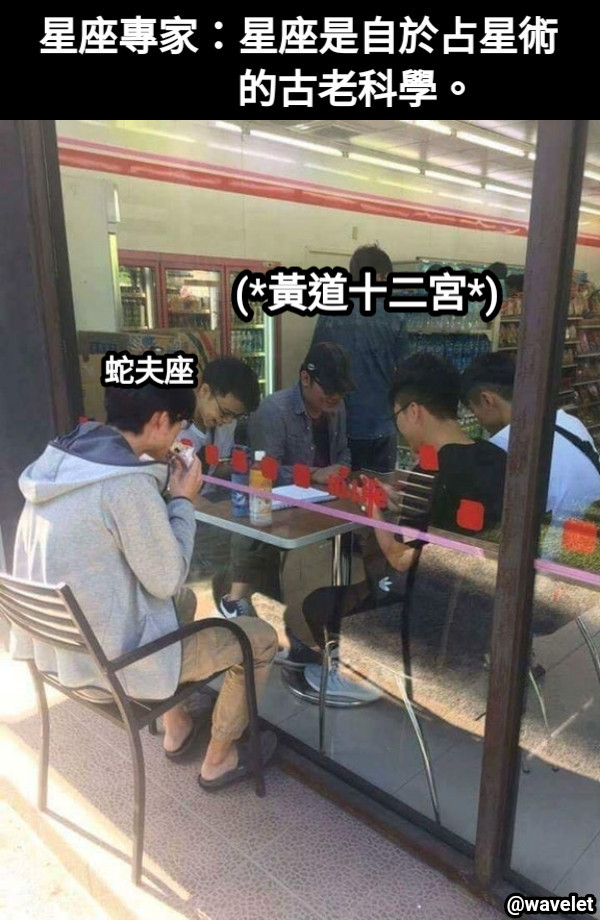
At what (x,y) coordinates should I click in order to perform the action: click on chair. Please return your answer as a coordinate pair (x, y). This screenshot has height=920, width=600. Looking at the image, I should click on (132, 710).